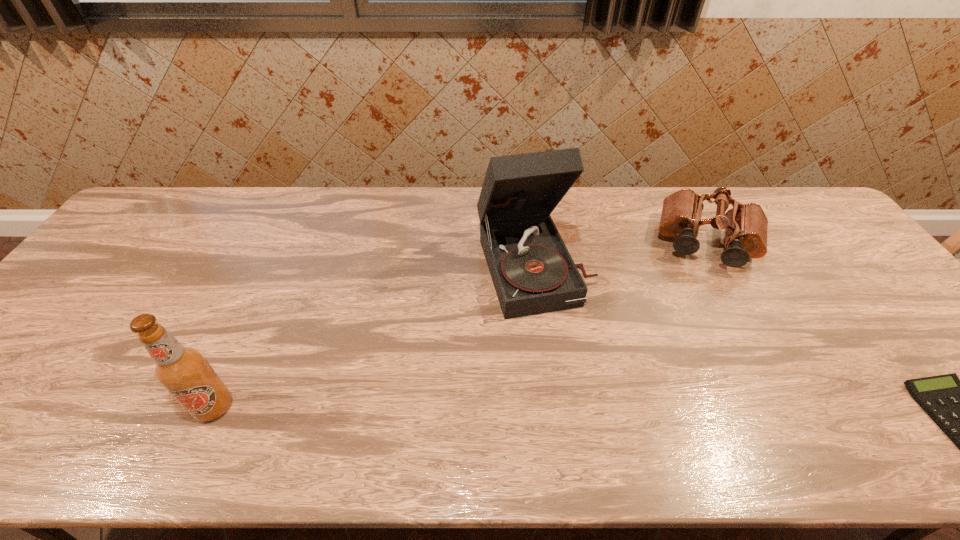
The height and width of the screenshot is (540, 960). I want to click on vacant region located 0.070m through the eyepieces of the third tallest object, so click(x=700, y=290).

Locate an element on the screen. This screenshot has width=960, height=540. free location located 0.160m through the eyepieces of the third tallest object is located at coordinates 697,313.

You are a GUI agent. You are given a task and a screenshot of the screen. Output one action in this format:
    pyautogui.click(x=<x>, y=<y>)
    Task: Click on the phonograph_record that is at the far edge
    The width and height of the screenshot is (960, 540).
    Given the screenshot: What is the action you would take?
    pyautogui.click(x=533, y=273)

Image resolution: width=960 pixels, height=540 pixels. I want to click on binoculars that is positioned at the far edge, so click(x=745, y=225).

At what (x,y) coordinates should I click in order to perform the action: click on object present at the near edge. Please return your answer as a coordinate pair (x, y). The image size is (960, 540). Looking at the image, I should click on (183, 371).

Find the location of `free location at the far edge`. free location at the far edge is located at coordinates (366, 215).

What are the coordinates of `vacant space at the near edge of the desktop` in the screenshot? It's located at (506, 380).

The image size is (960, 540). What are the coordinates of `free space at the left edge` in the screenshot? It's located at (36, 367).

The image size is (960, 540). In the image, there is a desktop. What are the coordinates of `vacant space at the right edge` in the screenshot? It's located at click(932, 343).

Where is `free space between the third object from right to left and the second object from right to left`? The width and height of the screenshot is (960, 540). free space between the third object from right to left and the second object from right to left is located at coordinates (621, 254).